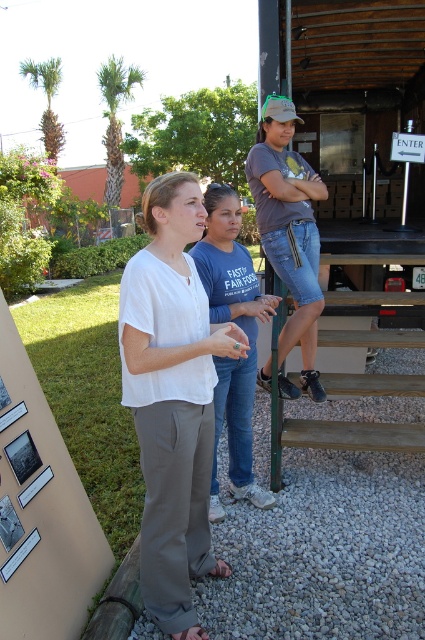
Question: Among these objects, which one is nearest to the camera?

Choices:
 (A) blue jeans at center
 (B) brown wooden stairs at center
 (C) denim shorts at center

Answer: (A)

Question: Among these objects, which one is farthest from the camera?

Choices:
 (A) blue jeans at center
 (B) matte white blouse at center
 (C) denim shorts at center

Answer: (C)

Question: Can you confirm if denim shorts at center is positioned to the left of brown wooden stairs at center?

Choices:
 (A) no
 (B) yes

Answer: (B)

Question: Can you confirm if denim shorts at center is wider than brown wooden stairs at center?

Choices:
 (A) yes
 (B) no

Answer: (B)

Question: Which point is closer to the camera?

Choices:
 (A) (286, 232)
 (B) (348, 449)
 (C) (136, 374)

Answer: (C)

Question: From the image, what is the correct spatial relationship of denim shorts at center in relation to brown wooden stairs at center?

Choices:
 (A) right
 (B) left

Answer: (B)